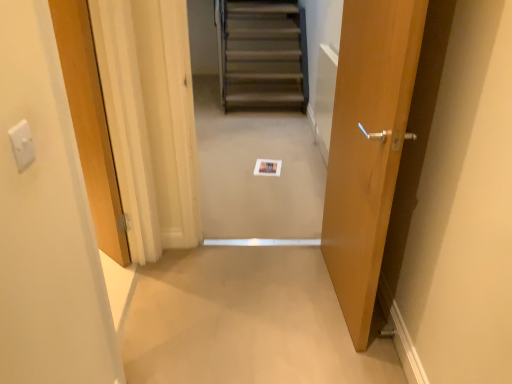
Identify the location of free point in front of matte wood door at right, the 1th door in the right-to-left sequence. Image resolution: width=512 pixels, height=384 pixels. (317, 349).